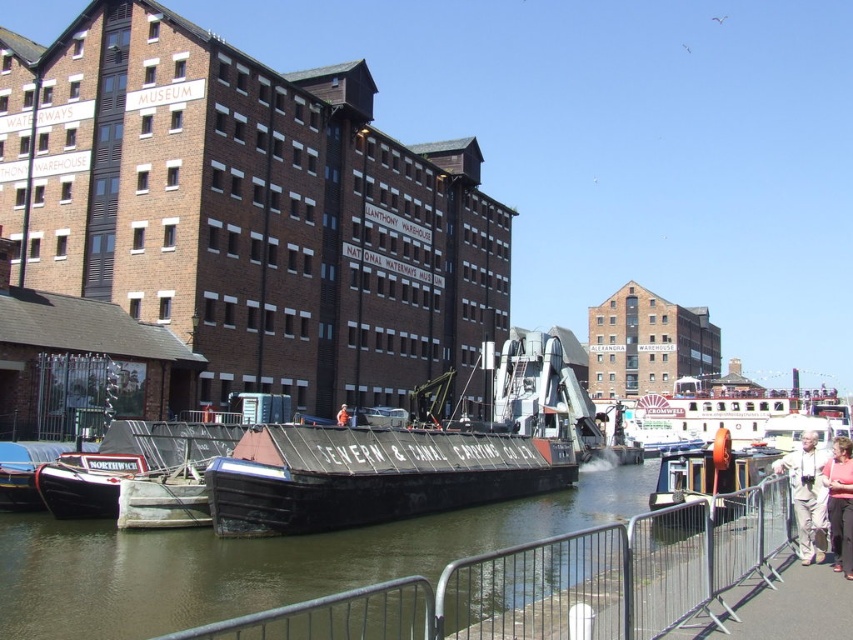
Does point (846, 500) lie in front of point (343, 419)?

That is True.

Is point (846, 444) positioned after point (345, 420)?

No, (846, 444) is closer to viewer.

Find the location of a particular element. pink fabric at lower right is located at coordinates (840, 502).

Between white wooden boat at center-right and pink fabric at lower right, which one is positioned higher?

pink fabric at lower right

Is point (766, 410) behind point (848, 548)?

Yes, point (766, 410) is farther from viewer.

Find the location of a particular element. This screenshot has width=853, height=640. white wooden boat at center-right is located at coordinates (730, 413).

Which of these two, light beige fabric pants at lower right or pink fabric at lower right, stands shorter?

pink fabric at lower right

Is light beige fabric pants at lower right below pink fabric at lower right?

Yes, light beige fabric pants at lower right is below pink fabric at lower right.

What do you see at coordinates (807, 496) in the screenshot?
I see `light beige fabric pants at lower right` at bounding box center [807, 496].

Find the location of a particular element. light beige fabric pants at lower right is located at coordinates (807, 496).